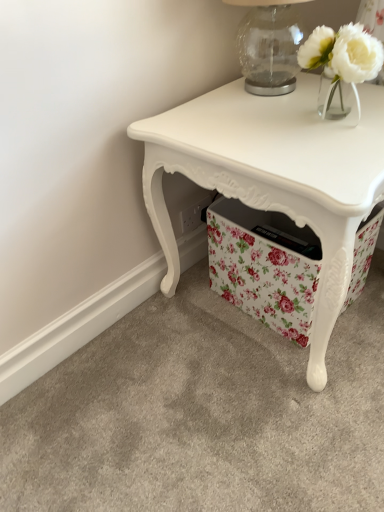
Where is `vacant space underneath white glass vase at upper right (from a real-world perspective)`? The image size is (384, 512). vacant space underneath white glass vase at upper right (from a real-world perspective) is located at coordinates (344, 113).